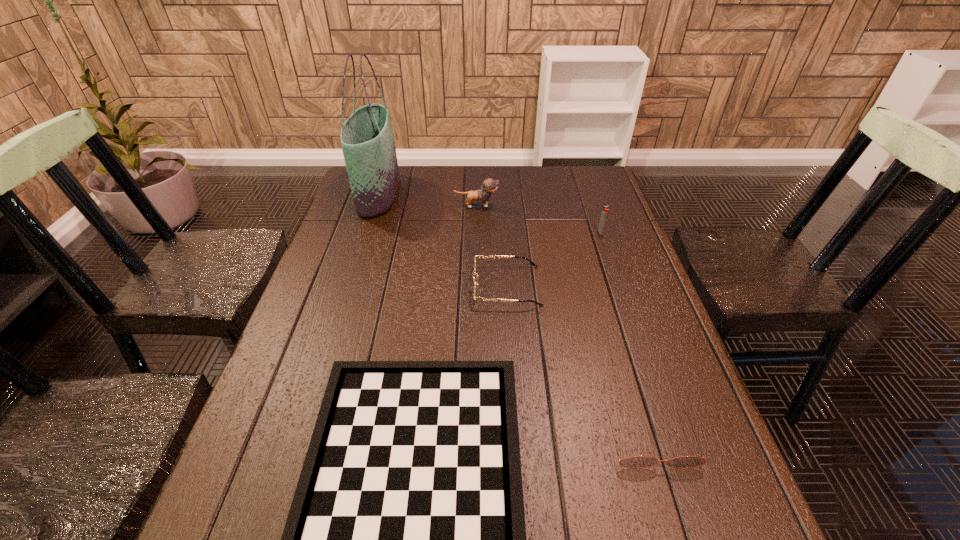
Identify the location of vacant region located 0.180m on the lenses of the spectacles. The image size is (960, 540). (403, 286).

The height and width of the screenshot is (540, 960). What are the coordinates of `free space located 0.120m on the lenses of the spectacles` in the screenshot? It's located at (426, 286).

Image resolution: width=960 pixels, height=540 pixels. Identify the location of tote bag located in the far edge section of the desktop. (367, 140).

You are a GUI agent. You are given a task and a screenshot of the screen. Output one action in this format:
    pyautogui.click(x=<x>, y=<y>)
    Task: Click on the kitten that is at the far edge
    The width and height of the screenshot is (960, 540).
    Given the screenshot: What is the action you would take?
    pyautogui.click(x=489, y=185)

Locate an element on the screen. object that is positioned at the left edge is located at coordinates (367, 140).

Where is `igniter located in the right edge section of the desktop`? igniter located in the right edge section of the desktop is located at coordinates (604, 213).

You are a GUI agent. You are given a task and a screenshot of the screen. Output one action in this format:
    pyautogui.click(x=<x>, y=<y>)
    Task: Click on the sunglasses at the right edge
    This screenshot has width=960, height=540.
    Given the screenshot: What is the action you would take?
    pyautogui.click(x=637, y=461)

This screenshot has height=540, width=960. Identify the location of object located in the far left corner section of the desktop. (367, 140).

What are the coordinates of `vacant space at the far edge of the desktop` in the screenshot? It's located at (560, 197).

Where is `vacant space at the left edge of the desktop`? vacant space at the left edge of the desktop is located at coordinates (292, 457).